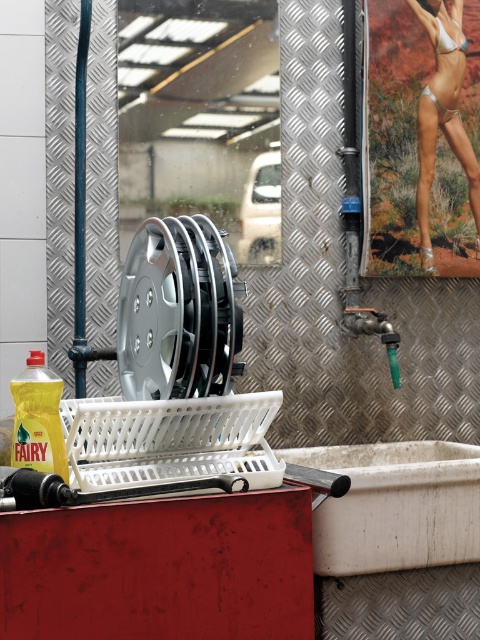
Between silver metallic bikini at upper right and white matte bikini top at upper right, which one is positioned lower?

silver metallic bikini at upper right is lower down.

Is the position of silver metallic bikini at upper right more distant than that of white matte bikini top at upper right?

No, it is not.

You are a GUI agent. You are given a task and a screenshot of the screen. Output one action in this format:
    pyautogui.click(x=<x>, y=<y>)
    Task: Click on the silver metallic bikini at upper right
    
    Given the screenshot: What is the action you would take?
    pyautogui.click(x=443, y=115)

At what (x,y) coordinates should I click in order to perform the action: click on silver metallic bikini at upper right. Please return your answer as a coordinate pair (x, y). The width and height of the screenshot is (480, 640). Looking at the image, I should click on (443, 115).

Can you confirm if silver metallic bikini at upper right is thinner than green plastic faucet at center right?

In fact, silver metallic bikini at upper right might be wider than green plastic faucet at center right.

Who is lower down, silver metallic bikini at upper right or green plastic faucet at center right?

green plastic faucet at center right

Locate an element on the screen. silver metallic bikini at upper right is located at coordinates (443, 115).

Is point (211, 241) positioned in front of point (436, 90)?

Yes.

Does silver metallic tire at center appear on the left side of silver metallic bikini at upper right?

Indeed, silver metallic tire at center is positioned on the left side of silver metallic bikini at upper right.

This screenshot has width=480, height=640. What do you see at coordinates (178, 310) in the screenshot?
I see `silver metallic tire at center` at bounding box center [178, 310].

Find the location of `silver metallic tire at center`. silver metallic tire at center is located at coordinates (178, 310).